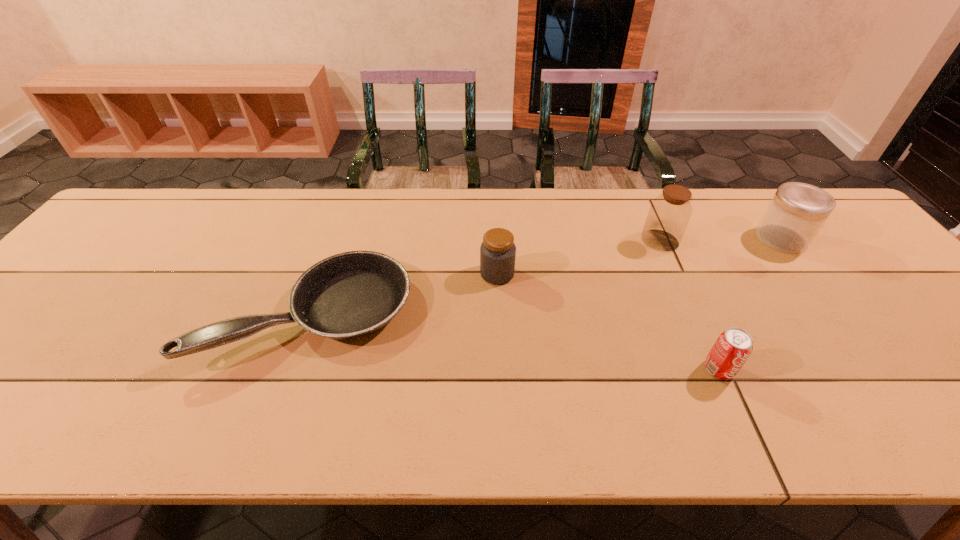
Find the location of a particular element. the fourth closest object to the leftmost object is located at coordinates (797, 212).

Find the location of `jar that is the closest to the second jar from right to left`. jar that is the closest to the second jar from right to left is located at coordinates (797, 212).

Choose which jar is the nearest neighbor to the second jar from right to left. Please provide its 2D coordinates. Your answer should be formatted as a tuple, i.e. [(x, y)], where the tuple contains the x and y coordinates of a point satisfying the conditions above.

[(797, 212)]

At what (x,y) coordinates should I click in order to perform the action: click on vacant region that satisfies the following two spatial constraints: 1. on the back side of the soda; 2. on the surface of the leftmost jar near the warning symbol. Please return your answer as a coordinate pair (x, y). The image size is (960, 540). Looking at the image, I should click on (676, 274).